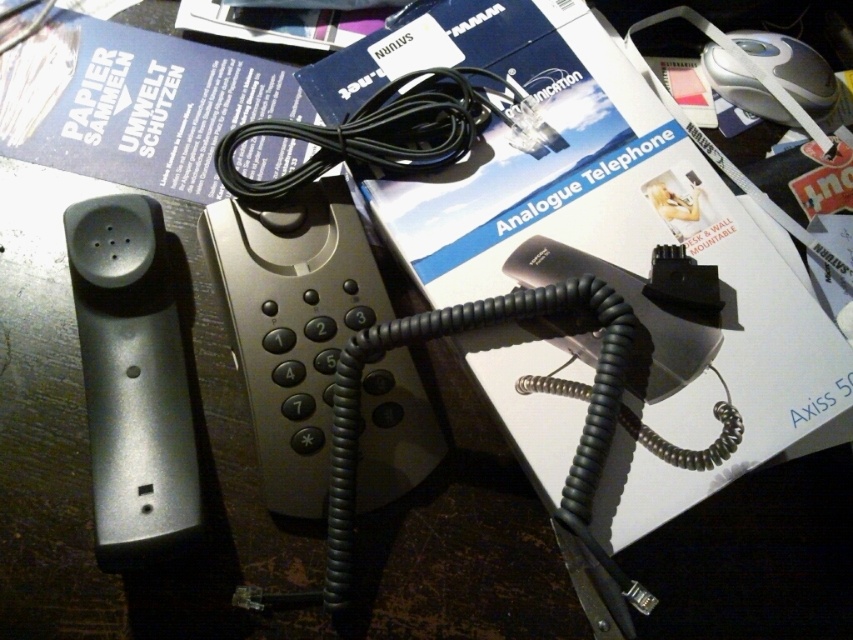
Question: Considering the real-world distances, which object is farthest from the black cable at center?

Choices:
 (A) matte gray handset at left
 (B) blue paper at upper left

Answer: (A)

Question: Based on their relative distances, which object is farther from the blue paper at upper left?

Choices:
 (A) black cable at center
 (B) matte gray handset at left

Answer: (B)

Question: Estimate the real-world distances between objects in this image. Which object is farther from the blue paper at upper left?

Choices:
 (A) black cable at center
 (B) matte gray handset at left

Answer: (B)

Question: Does blue paper at upper left appear on the left side of black cable at center?

Choices:
 (A) no
 (B) yes

Answer: (B)

Question: Does blue paper at upper left have a lesser width compared to matte gray handset at left?

Choices:
 (A) no
 (B) yes

Answer: (A)

Question: Considering the relative positions of matte gray handset at left and black cable at center in the image provided, where is matte gray handset at left located with respect to black cable at center?

Choices:
 (A) above
 (B) below

Answer: (B)